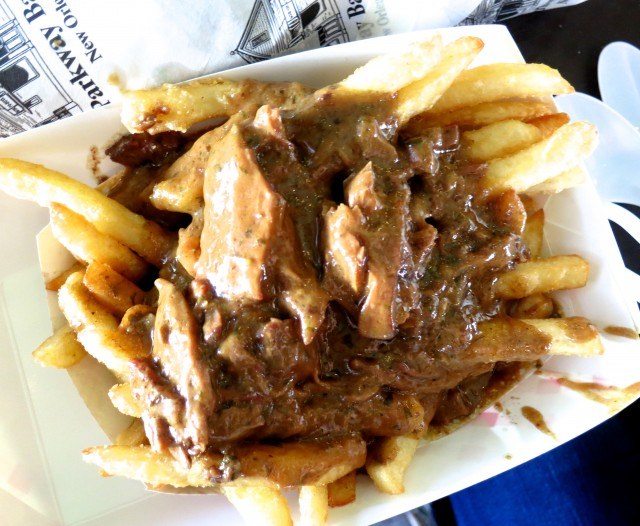
Where is `spoon`? The height and width of the screenshot is (526, 640). spoon is located at coordinates (630, 175).